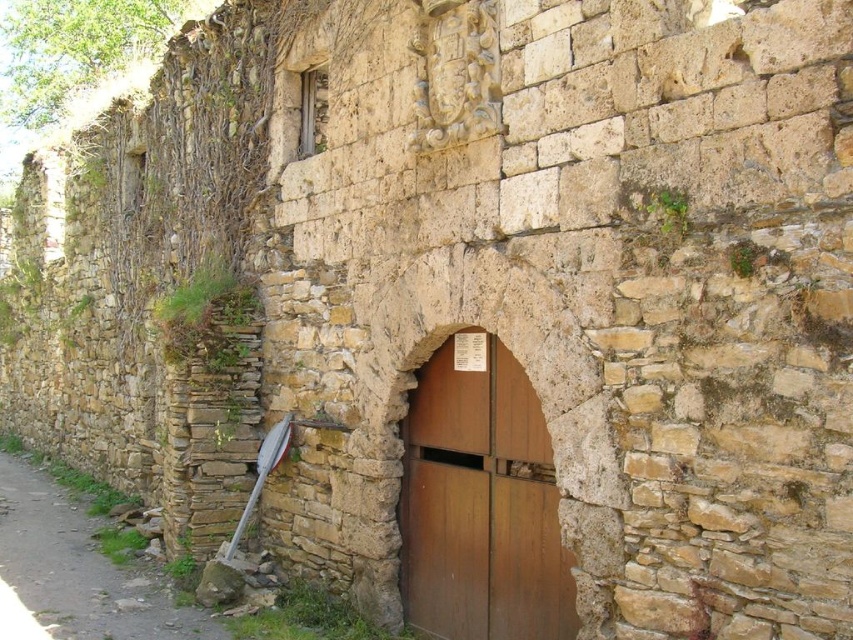
Does brown wooden door at center appear under dirt path at lower left?

No.

Between point (457, 480) and point (39, 502), which one is positioned in front?

Point (457, 480) is in front.

From the picture: Who is more forward, (445, 444) or (86, 600)?

Positioned in front is point (445, 444).

Find the location of a particular element. The height and width of the screenshot is (640, 853). brown wooden door at center is located at coordinates (480, 500).